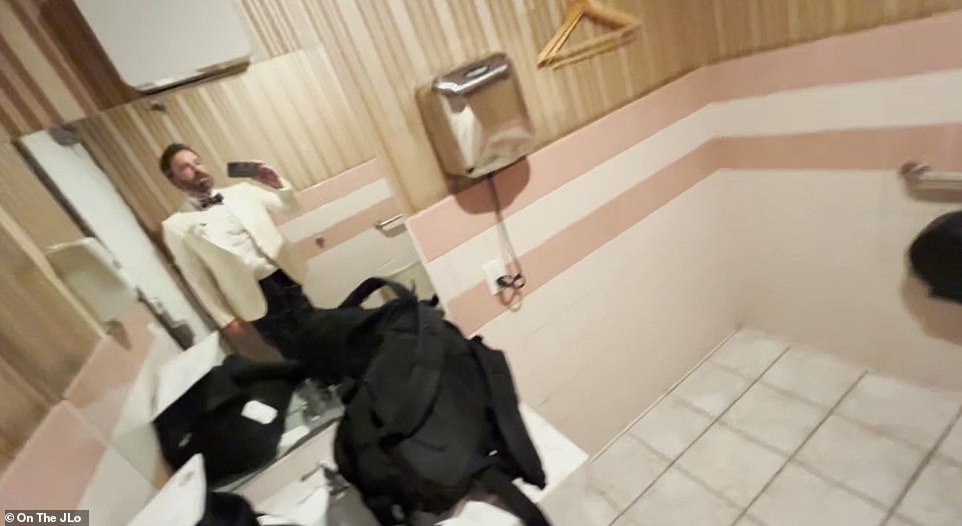
What are the coordinates of `box` in the screenshot? It's located at (482, 125).